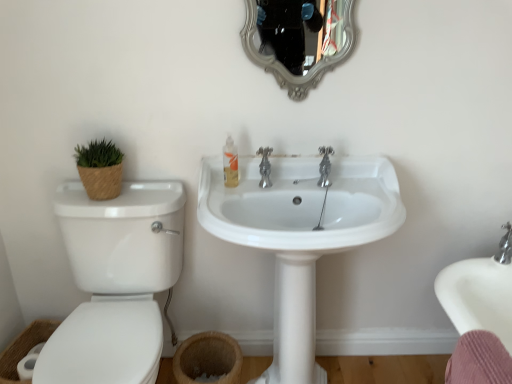
Question: Is chrome metallic faucet at center bigger or smaller than translucent plastic soap dispenser at center?

Choices:
 (A) small
 (B) big

Answer: (B)

Question: From a real-world perspective, is chrome metallic faucet at center physically located above or below translucent plastic soap dispenser at center?

Choices:
 (A) above
 (B) below

Answer: (B)

Question: Considering the real-world distances, which object is closest to the translucent plastic soap dispenser at center?

Choices:
 (A) white glossy sink at center
 (B) silver/gilded mirror at upper center
 (C) chrome metallic faucet at center
 (D) white glossy toilet at left

Answer: (C)

Question: Which object is the farthest from the silver/gilded mirror at upper center?

Choices:
 (A) white glossy toilet at left
 (B) white glossy sink at center
 (C) translucent plastic soap dispenser at center
 (D) chrome metallic faucet at center

Answer: (A)